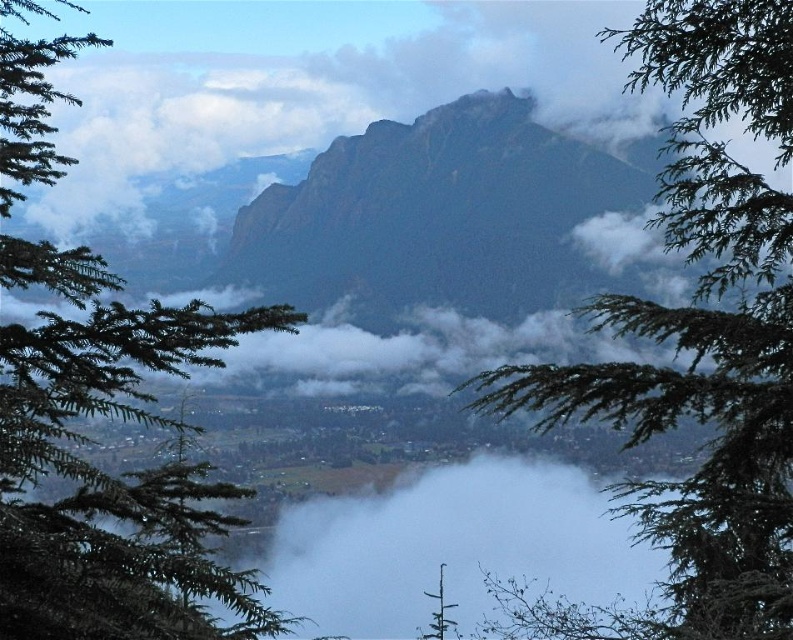
Is the position of green needle-like branches at left more distant than that of rugged stone mountain at center?

No.

Which is in front, point (152, 348) or point (439, 282)?

Point (152, 348)

Does point (106, 632) lie behind point (328, 220)?

No, it is in front of (328, 220).

The image size is (793, 640). I want to click on green needle-like branches at left, so click(x=102, y=472).

Is the position of rugged stone mountain at center more distant than that of green matte tree at center?

Yes, rugged stone mountain at center is further from the viewer.

Where is `rugged stone mountain at center`? This screenshot has width=793, height=640. rugged stone mountain at center is located at coordinates 443,214.

Can you confirm if green needle-like tree at center is bigger than green needle-like branches at left?

Incorrect, green needle-like tree at center is not larger than green needle-like branches at left.

Is green needle-like tree at center positioned at the back of green needle-like branches at left?

Yes, green needle-like tree at center is behind green needle-like branches at left.

Which is behind, point (688, 253) or point (6, 416)?

The point (688, 253) is more distant.

Where is `green needle-like tree at center`? The height and width of the screenshot is (640, 793). green needle-like tree at center is located at coordinates (700, 337).